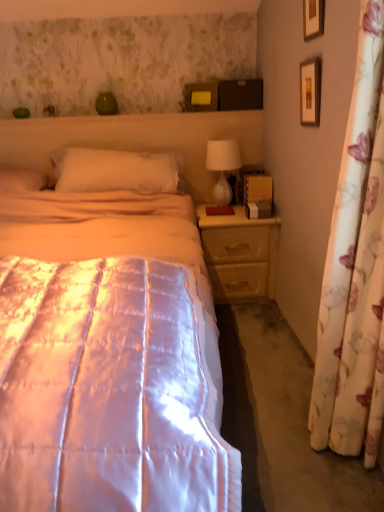
Question: Is wooden picture frame at upper right, the first picture frame in the bottom-to-top sequence, taller than white glossy table lamp at upper right?

Choices:
 (A) yes
 (B) no

Answer: (B)

Question: Does wooden picture frame at upper right, the second picture frame when ordered from top to bottom, have a larger size compared to white glossy table lamp at upper right?

Choices:
 (A) yes
 (B) no

Answer: (B)

Question: Is wooden picture frame at upper right, the first picture frame in the bottom-to-top sequence, to the right of white glossy table lamp at upper right from the viewer's perspective?

Choices:
 (A) no
 (B) yes

Answer: (B)

Question: Is wooden picture frame at upper right, the first picture frame in the bottom-to-top sequence, not within white glossy table lamp at upper right?

Choices:
 (A) no
 (B) yes

Answer: (B)

Question: Considering the relative sizes of wooden picture frame at upper right, the second picture frame when ordered from top to bottom, and white glossy table lamp at upper right in the image provided, is wooden picture frame at upper right, the second picture frame when ordered from top to bottom, wider than white glossy table lamp at upper right?

Choices:
 (A) no
 (B) yes

Answer: (A)

Question: From a real-world perspective, is wooden picture frame at upper right, the second picture frame when ordered from top to bottom, positioned over white glossy table lamp at upper right based on gravity?

Choices:
 (A) yes
 (B) no

Answer: (A)

Question: Is floral fabric curtain at right positioned with its back to wooden picture frame at upper right, acting as the second picture frame starting from the bottom?

Choices:
 (A) no
 (B) yes

Answer: (A)

Question: From the image's perspective, is floral fabric curtain at right beneath wooden picture frame at upper right, acting as the second picture frame starting from the bottom?

Choices:
 (A) yes
 (B) no

Answer: (A)

Question: Is floral fabric curtain at right at the right side of wooden picture frame at upper right, acting as the second picture frame starting from the bottom?

Choices:
 (A) yes
 (B) no

Answer: (B)

Question: Does floral fabric curtain at right have a smaller size compared to wooden picture frame at upper right, marked as the 1th picture frame in a top-to-bottom arrangement?

Choices:
 (A) yes
 (B) no

Answer: (B)

Question: Is floral fabric curtain at right closer to the viewer compared to wooden picture frame at upper right, marked as the 1th picture frame in a top-to-bottom arrangement?

Choices:
 (A) yes
 (B) no

Answer: (A)

Question: From the image's perspective, would you say floral fabric curtain at right is positioned over wooden picture frame at upper right, acting as the second picture frame starting from the bottom?

Choices:
 (A) yes
 (B) no

Answer: (B)

Question: Does light wood/texture nightstand at right appear on the left side of floral fabric curtain at right?

Choices:
 (A) yes
 (B) no

Answer: (A)